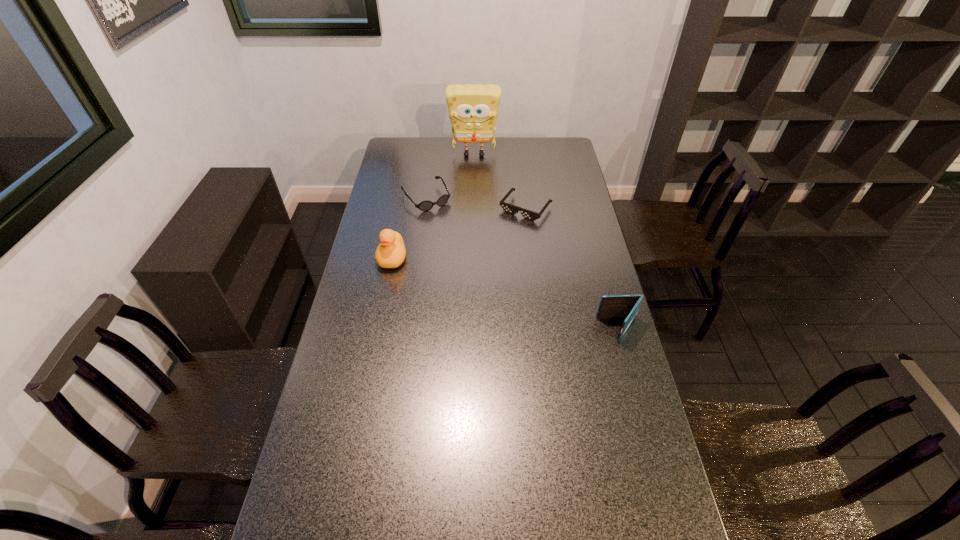
Locate an element on the screen. The height and width of the screenshot is (540, 960). free location located on the face of the duck is located at coordinates (384, 299).

This screenshot has height=540, width=960. I want to click on free space located 0.060m on the exterior surface of the rightmost object, so click(x=581, y=329).

Where is `free space located on the exterior surface of the rightmost object`? This screenshot has width=960, height=540. free space located on the exterior surface of the rightmost object is located at coordinates (577, 329).

Identify the location of vacant space situated on the exterior surface of the rightmost object. (556, 329).

I want to click on free region located 0.060m on the lenses of the taller sunglasses, so click(x=443, y=219).

You are a GUI agent. You are given a task and a screenshot of the screen. Output one action in this format:
    pyautogui.click(x=<x>, y=<y>)
    Task: Click on the vacant space located on the lenses of the taller sunglasses
    
    Given the screenshot: What is the action you would take?
    pyautogui.click(x=458, y=238)

Where is `free point located on the lenses of the taller sunglasses`? This screenshot has height=540, width=960. free point located on the lenses of the taller sunglasses is located at coordinates pyautogui.click(x=443, y=219).

This screenshot has width=960, height=540. Identify the location of free space located 0.260m on the face of the farthest object. (472, 193).

Locate an element on the screen. This screenshot has width=960, height=540. vacant space located 0.330m on the face of the farthest object is located at coordinates (472, 202).

In order to click on free space located on the face of the farthest object in this screenshot , I will do `click(473, 170)`.